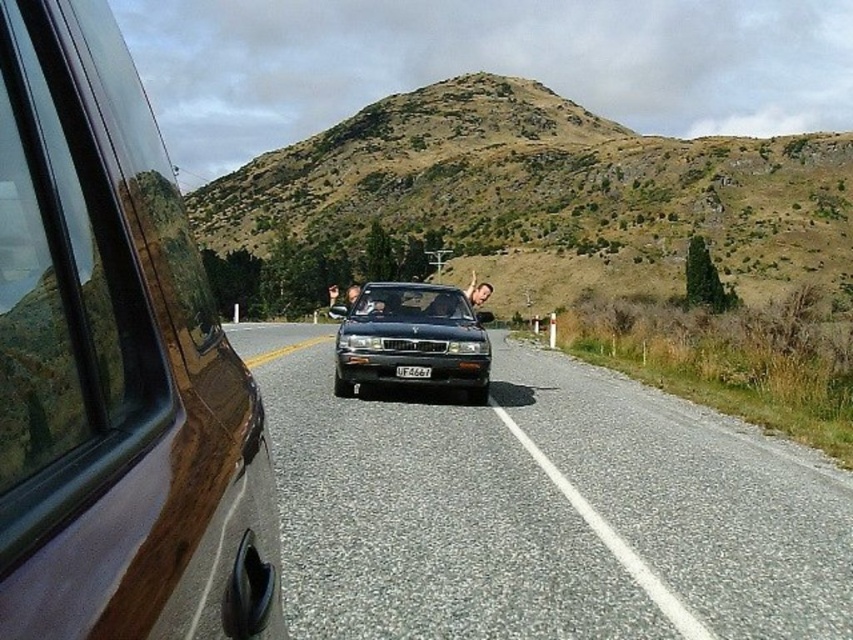
Which is behind, point (148, 458) or point (426, 376)?

The point (426, 376) is behind.

Is point (59, 468) positioned before point (408, 369)?

Yes, point (59, 468) is closer to viewer.

Identify the location of brown matte suv at left. (115, 365).

This screenshot has height=640, width=853. Describe the element at coordinates (115, 365) in the screenshot. I see `brown matte suv at left` at that location.

Can you confirm if brown matte suv at left is thinner than light brown hair at center?

In fact, brown matte suv at left might be wider than light brown hair at center.

Image resolution: width=853 pixels, height=640 pixels. What do you see at coordinates (115, 365) in the screenshot? I see `brown matte suv at left` at bounding box center [115, 365].

The image size is (853, 640). What are the coordinates of `brown matte suv at left` in the screenshot? It's located at (115, 365).

Is brown matte suv at left in front of smooth skin face at center?

Yes, it is in front of smooth skin face at center.

Is brown matte suv at left to the right of smooth skin face at center from the viewer's perspective?

Incorrect, brown matte suv at left is not on the right side of smooth skin face at center.

Which is behind, point (120, 348) or point (357, 298)?

Positioned behind is point (357, 298).

At what (x,y) coordinates should I click in order to perform the action: click on brown matte suv at left. Please return your answer as a coordinate pair (x, y). Looking at the image, I should click on click(115, 365).